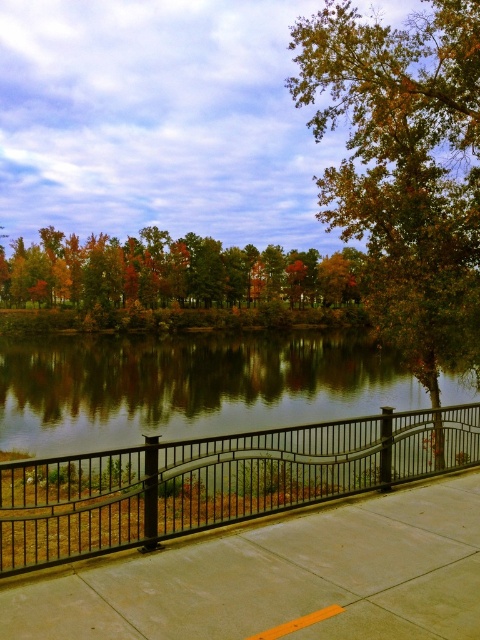
Question: Which object appears farthest from the camera in this image?

Choices:
 (A) concrete at center
 (B) autumn leaves at center
 (C) golden leaves tree at center
 (D) glossy black water at center

Answer: (B)

Question: Which object is positioned farthest from the concrete at center?

Choices:
 (A) glossy black water at center
 (B) autumn leaves at center

Answer: (B)

Question: Where is golden leaves tree at center located in relation to glossy black water at center in the image?

Choices:
 (A) left
 (B) right

Answer: (B)

Question: Does concrete at center appear under golden leaves tree at center?

Choices:
 (A) no
 (B) yes

Answer: (B)

Question: Which object appears closest to the camera in this image?

Choices:
 (A) autumn leaves at center
 (B) golden leaves tree at center
 (C) concrete at center

Answer: (C)

Question: Considering the relative positions of golden leaves tree at center and autumn leaves at center in the image provided, where is golden leaves tree at center located with respect to autumn leaves at center?

Choices:
 (A) left
 (B) right

Answer: (B)